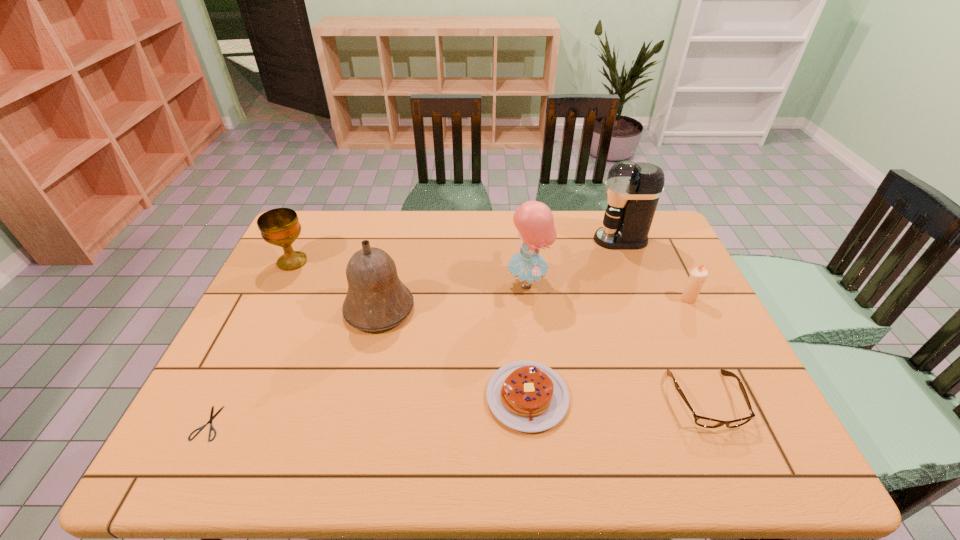
Identify the location of the fifth closest object to the chalice. (633, 190).

The image size is (960, 540). What are the coordinates of `free space that satisfies the following two spatial constraints: 1. on the back side of the shortest object; 2. on the right side of the pancake` in the screenshot? It's located at (222, 397).